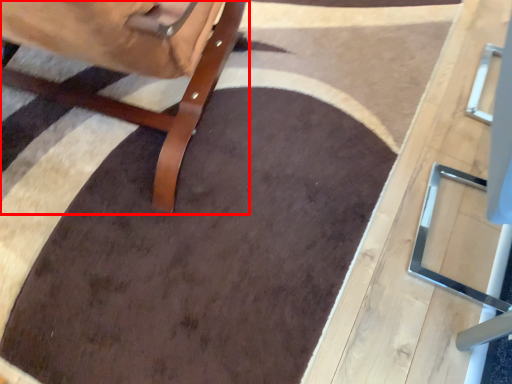
Question: From the image's perspective, what is the correct spatial relationship of furniture (annotated by the red box) in relation to table?

Choices:
 (A) below
 (B) above

Answer: (B)